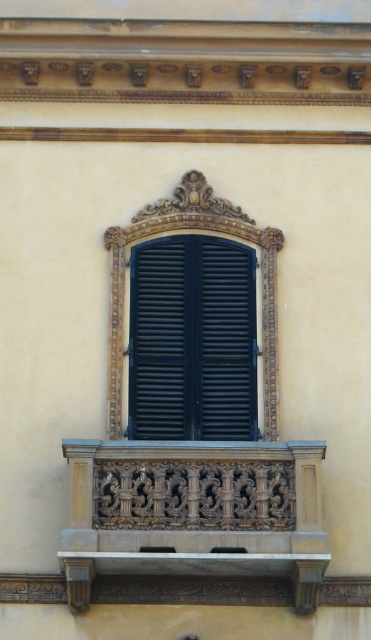
From the picture: You are an architect inspecting the building facade. You need to determine the spatial relationship between the carved wood balcony at lower center and the matte black shutters at center. Which object is positioned lower in the image?

The carved wood balcony at lower center is positioned below the matte black shutters at center, so it is the lower object.

You are standing in front of the building and want to determine which of the two points, point (97, 460) or point (217, 365), is closer to you. Based on the image, which point is nearer?

Point (97, 460) is closer to the viewer than point (217, 365).